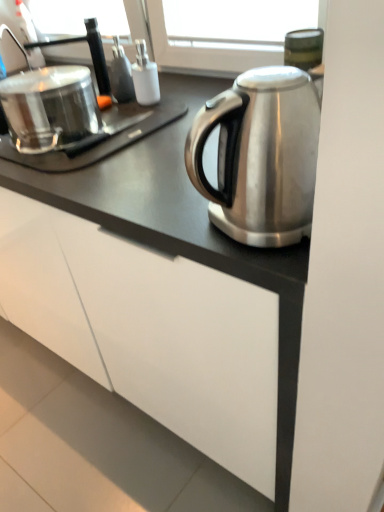
Question: Does shiny metallic pot at left turn towards white matte cabinet at lower center?

Choices:
 (A) no
 (B) yes

Answer: (A)

Question: Can you confirm if shiny metallic pot at left is wider than white matte cabinet at lower center?

Choices:
 (A) no
 (B) yes

Answer: (A)

Question: From a real-world perspective, is shiny metallic pot at left physically below white matte cabinet at lower center?

Choices:
 (A) no
 (B) yes

Answer: (A)

Question: Is shiny metallic pot at left shorter than white matte cabinet at lower center?

Choices:
 (A) yes
 (B) no

Answer: (B)

Question: Is shiny metallic pot at left with white matte cabinet at lower center?

Choices:
 (A) no
 (B) yes

Answer: (A)

Question: Is point (210, 270) positioned closer to the camera than point (67, 137)?

Choices:
 (A) closer
 (B) farther

Answer: (A)

Question: In terms of width, does white matte cabinet at lower center look wider or thinner when compared to shiny metallic pot at left?

Choices:
 (A) thin
 (B) wide

Answer: (B)

Question: From the image's perspective, is white matte cabinet at lower center above or below shiny metallic pot at left?

Choices:
 (A) below
 (B) above

Answer: (A)

Question: Based on their positions, is white matte cabinet at lower center located to the left or right of shiny metallic pot at left?

Choices:
 (A) left
 (B) right

Answer: (A)

Question: From the image's perspective, is shiny metallic pot at left above or below brushed metal faucet at upper left?

Choices:
 (A) below
 (B) above

Answer: (A)

Question: Is shiny metallic pot at left spatially inside brushed metal faucet at upper left, or outside of it?

Choices:
 (A) inside
 (B) outside

Answer: (B)

Question: From their relative heights in the image, would you say shiny metallic pot at left is taller or shorter than brushed metal faucet at upper left?

Choices:
 (A) tall
 (B) short

Answer: (A)

Question: In the image, is shiny metallic pot at left positioned in front of or behind brushed metal faucet at upper left?

Choices:
 (A) front
 (B) behind

Answer: (A)

Question: From a real-world perspective, is brushed metal faucet at upper left above or below shiny metallic pot at left?

Choices:
 (A) above
 (B) below

Answer: (A)

Question: Is brushed metal faucet at upper left bigger or smaller than shiny metallic pot at left?

Choices:
 (A) small
 (B) big

Answer: (A)